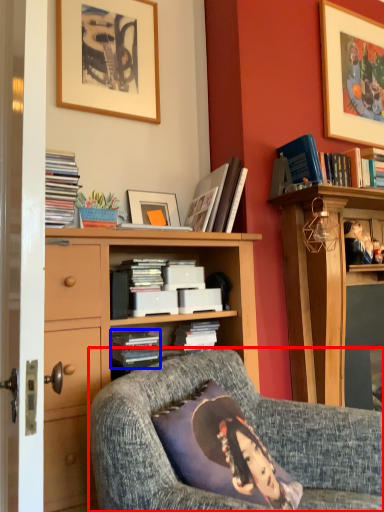
Question: Which object appears farthest to the camera in this image, chair (highlighted by a red box) or book (highlighted by a blue box)?

Choices:
 (A) chair
 (B) book

Answer: (B)